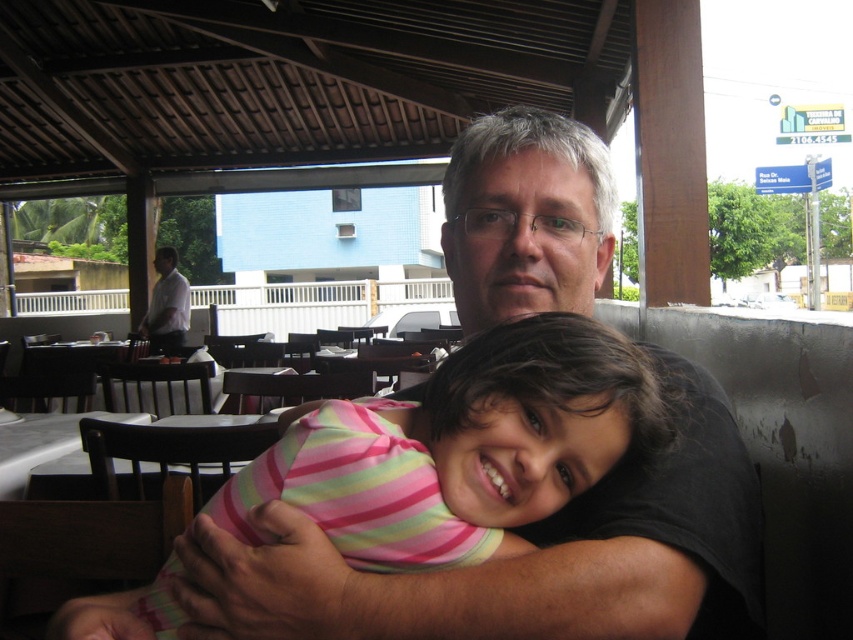
Question: Which object is closer to the camera taking this photo?

Choices:
 (A) pink striped shirt at center
 (B) white shirt at left

Answer: (A)

Question: Which point appears closest to the camera in this image?

Choices:
 (A) (160, 340)
 (B) (601, 403)

Answer: (B)

Question: In this image, where is pink striped shirt at center located relative to white shirt at left?

Choices:
 (A) above
 (B) below

Answer: (B)

Question: Can you confirm if pink striped shirt at center is positioned to the right of white shirt at left?

Choices:
 (A) yes
 (B) no

Answer: (A)

Question: Can you confirm if pink striped shirt at center is positioned below white shirt at left?

Choices:
 (A) no
 (B) yes

Answer: (B)